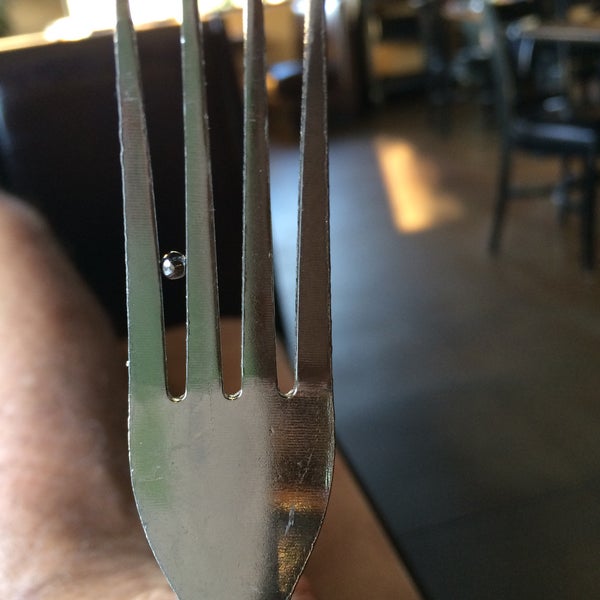
Where is `first prong on fork - leftmost`? first prong on fork - leftmost is located at coordinates (149, 355).